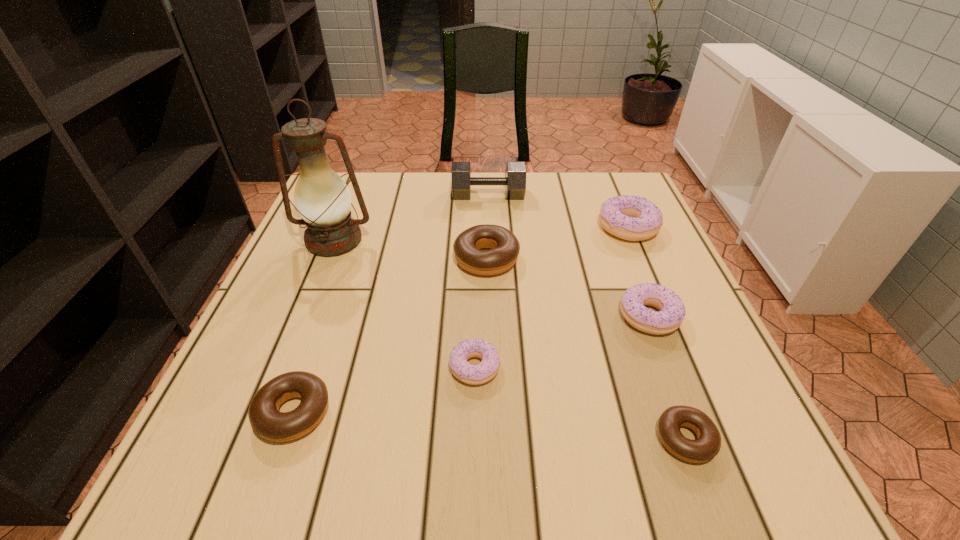
Locate an element on the screen. the leftmost purple doughnut is located at coordinates (478, 374).

This screenshot has width=960, height=540. Find the location of `the smallest purple doughnut`. the smallest purple doughnut is located at coordinates coord(478,374).

I want to click on the smallest brown doughnut, so click(707, 445).

You are a GUI agent. You are given a task and a screenshot of the screen. Output one action in this format:
    pyautogui.click(x=<x>, y=<y>)
    Task: Click on the vacant space located 0.350m on the right of the tallest object
    This screenshot has width=960, height=540.
    Given the screenshot: What is the action you would take?
    pyautogui.click(x=520, y=241)

I want to click on vacant region located 0.230m on the left of the seventh shortest object, so click(370, 195).

Identify the location of vacant space located 0.050m on the front of the farthest purple doughnut. This screenshot has width=960, height=540. (641, 259).

Where is `vacant area located 0.350m on the left of the biggest brown doughnut`? The height and width of the screenshot is (540, 960). vacant area located 0.350m on the left of the biggest brown doughnut is located at coordinates (300, 259).

Where is `free space located on the left of the second biggest purple doughnut`? The image size is (960, 540). free space located on the left of the second biggest purple doughnut is located at coordinates (568, 316).

At what (x,y) coordinates should I click in order to perform the action: click on free space located 0.100m on the right of the leftmost brown doughnut. Please return your answer as a coordinate pair (x, y). This screenshot has width=960, height=540. Looking at the image, I should click on pos(393,413).

You are a GUI agent. You are given a task and a screenshot of the screen. Output one action in this format:
    pyautogui.click(x=<x>, y=<y>)
    Task: Click on the vacant space located 0.110m on the right of the nearest purple doughnut
    This screenshot has width=960, height=540.
    Given the screenshot: What is the action you would take?
    pyautogui.click(x=563, y=368)